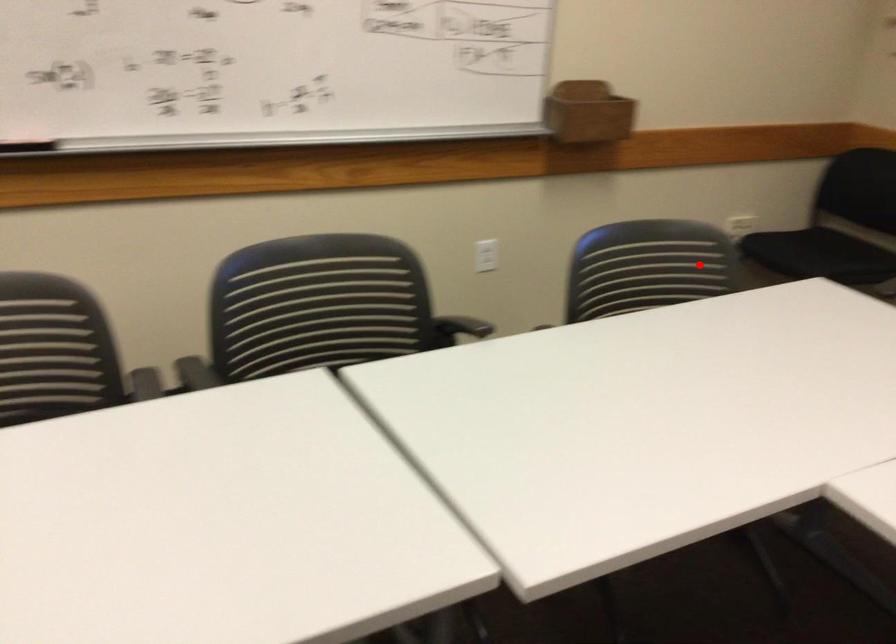
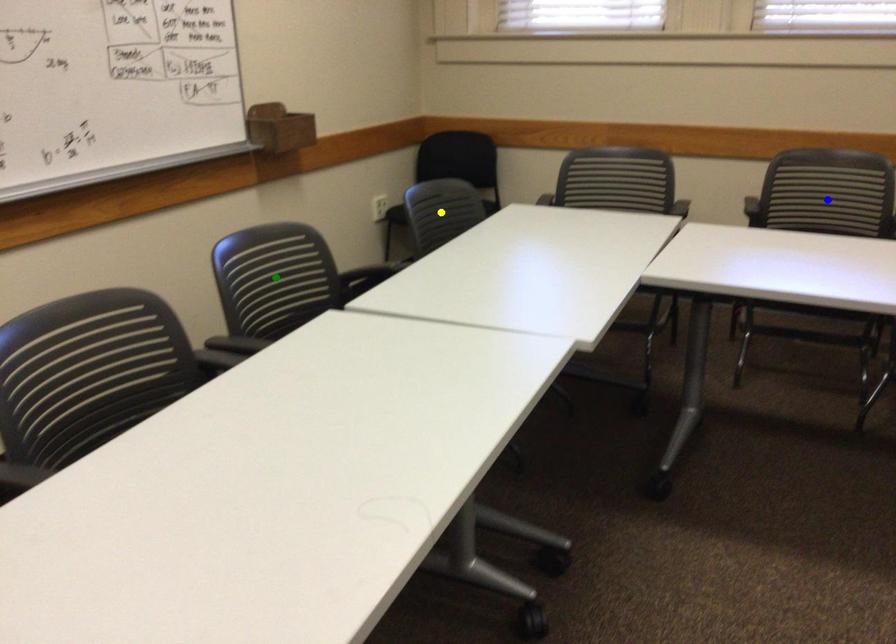
Question: I am providing you with two images of the same scene from different viewpoints. A red point is marked on the first image. You are given multiple points on the second image. Which point in image 2 represents the same 3d spot as the red point in image 1?

Choices:
 (A) blue point
 (B) yellow point
 (C) green point

Answer: (B)